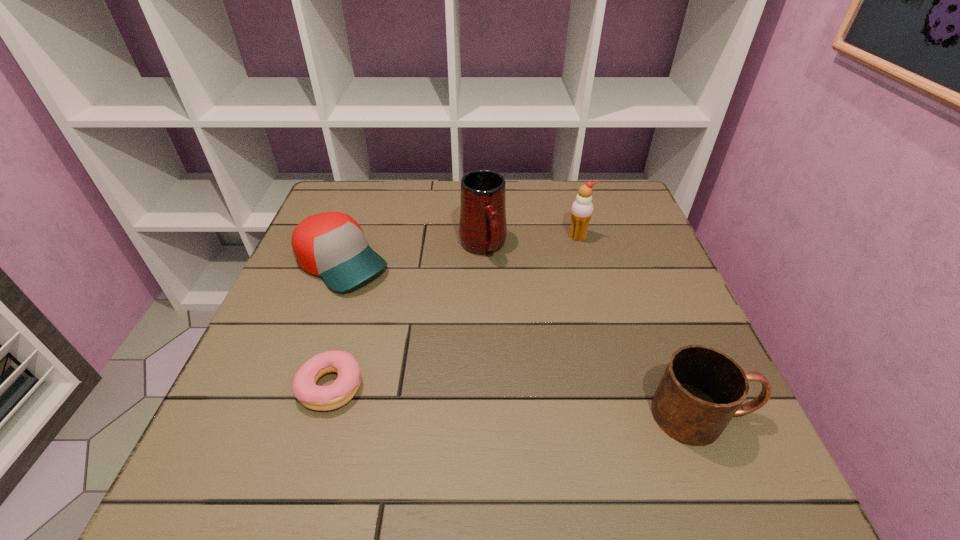
At what (x,y) coordinates should I click in order to perform the action: click on free spot between the baseball cap and the shorter mug. Please return your answer as a coordinate pair (x, y). Looking at the image, I should click on (522, 339).

Locate which object ranks in proximity to the taller mug. Please provide its 2D coordinates. Your answer should be formatted as a tuple, i.e. [(x, y)], where the tuple contains the x and y coordinates of a point satisfying the conditions above.

[(582, 208)]

Identify which object is the closest to the baseball cap. Please provide its 2D coordinates. Your answer should be formatted as a tuple, i.e. [(x, y)], where the tuple contains the x and y coordinates of a point satisfying the conditions above.

[(482, 226)]

You are a GUI agent. You are given a task and a screenshot of the screen. Output one action in this format:
    pyautogui.click(x=<x>, y=<y>)
    Task: Click on the blank area in the image that satisfies the following two spatial constraints: 1. on the front side of the rightmost object; 2. on the side of the taller mug with the handle
    
    Given the screenshot: What is the action you would take?
    pyautogui.click(x=484, y=415)

Find the location of `blank space that satisfies the following two spatial constraints: 1. on the front side of the baseball cap; 2. on the side of the right mug with the handle`. blank space that satisfies the following two spatial constraints: 1. on the front side of the baseball cap; 2. on the side of the right mug with the handle is located at coordinates (287, 415).

The width and height of the screenshot is (960, 540). Find the location of `vacant space that satisfies the following two spatial constraints: 1. on the back side of the second object from right to left; 2. on the left side of the doughnut`. vacant space that satisfies the following two spatial constraints: 1. on the back side of the second object from right to left; 2. on the left side of the doughnut is located at coordinates (374, 237).

In order to click on blank area in the image that satisfies the following two spatial constraints: 1. on the front side of the third object from right to left; 2. on the side of the shorter mug with the handle in this screenshot , I will do `click(484, 415)`.